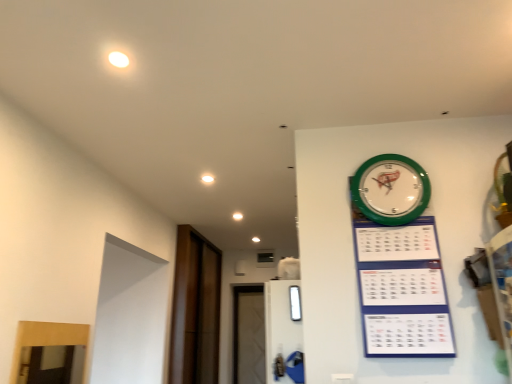
Question: Does green plastic wall clock at upper right have a larger size compared to green plastic calendar at upper right?

Choices:
 (A) no
 (B) yes

Answer: (A)

Question: Can you confirm if green plastic wall clock at upper right is wider than green plastic calendar at upper right?

Choices:
 (A) yes
 (B) no

Answer: (B)

Question: Considering the relative positions of green plastic wall clock at upper right and green plastic calendar at upper right in the image provided, is green plastic wall clock at upper right to the right of green plastic calendar at upper right from the viewer's perspective?

Choices:
 (A) no
 (B) yes

Answer: (B)

Question: Is green plastic wall clock at upper right shorter than green plastic calendar at upper right?

Choices:
 (A) no
 (B) yes

Answer: (B)

Question: Considering the relative sizes of green plastic wall clock at upper right and green plastic calendar at upper right in the image provided, is green plastic wall clock at upper right thinner than green plastic calendar at upper right?

Choices:
 (A) yes
 (B) no

Answer: (A)

Question: Is green plastic wall clock at upper right outside green plastic calendar at upper right?

Choices:
 (A) yes
 (B) no

Answer: (B)

Question: From a real-world perspective, is brown wood door at left on top of transparent glass window at center?

Choices:
 (A) yes
 (B) no

Answer: (A)

Question: From the image's perspective, is brown wood door at left located beneath transparent glass window at center?

Choices:
 (A) no
 (B) yes

Answer: (B)

Question: From the image's perspective, is brown wood door at left located above transparent glass window at center?

Choices:
 (A) no
 (B) yes

Answer: (A)

Question: From a real-world perspective, is brown wood door at left below transparent glass window at center?

Choices:
 (A) no
 (B) yes

Answer: (A)

Question: Is brown wood door at left to the left of transparent glass window at center from the viewer's perspective?

Choices:
 (A) yes
 (B) no

Answer: (A)

Question: Considering the relative sizes of brown wood door at left and transparent glass window at center in the image provided, is brown wood door at left bigger than transparent glass window at center?

Choices:
 (A) no
 (B) yes

Answer: (B)

Question: Would you say brown wood door at left is a long distance from green plastic calendar at upper right?

Choices:
 (A) yes
 (B) no

Answer: (A)